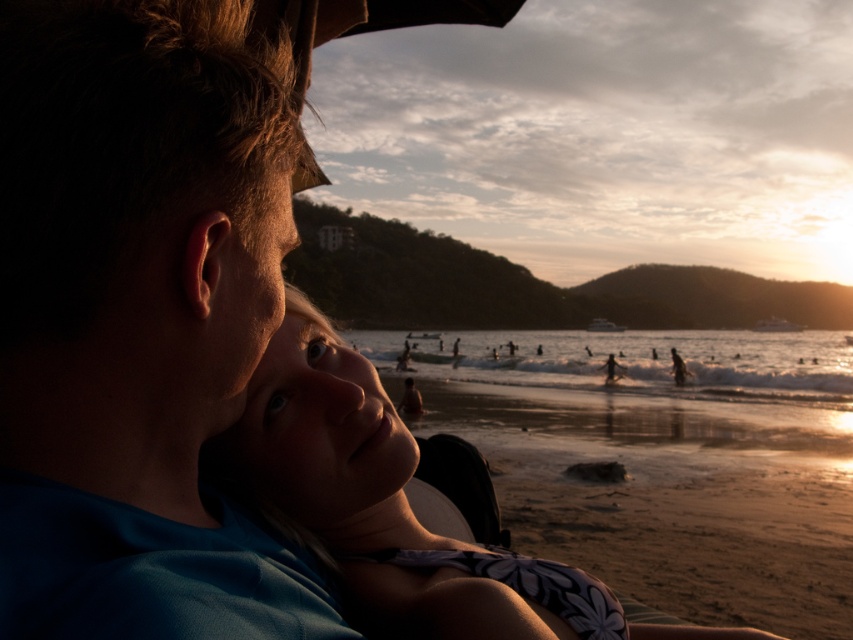
You are a photographer trying to capture the two people at the center of the beach scene. Since the blue fabric shirt at center and the smooth skin face at center are important subjects, can you tell me which one is positioned more to the left side of the frame?

The blue fabric shirt at center is positioned to the left of the smooth skin face at center, so the blue fabric shirt at center is more to the left side of the frame.

You are standing at the beach and see two points in the scene. The first point is labeled as point (x=119, y=108) and the second is point (x=502, y=627). Which point is closer to your current position?

Point (x=119, y=108) is closer to the camera than point (x=502, y=627), so the first point is closer to your current position.